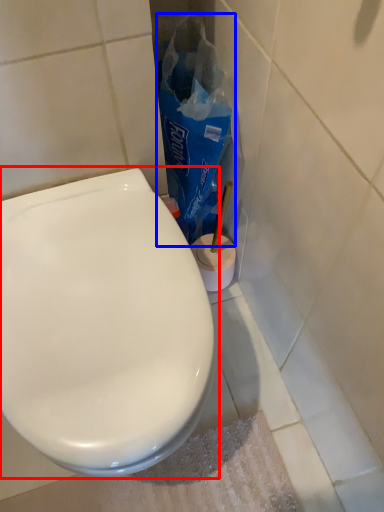
Question: Which object appears closest to the camera in this image, toilet (highlighted by a red box) or paper bag (highlighted by a blue box)?

Choices:
 (A) toilet
 (B) paper bag

Answer: (A)